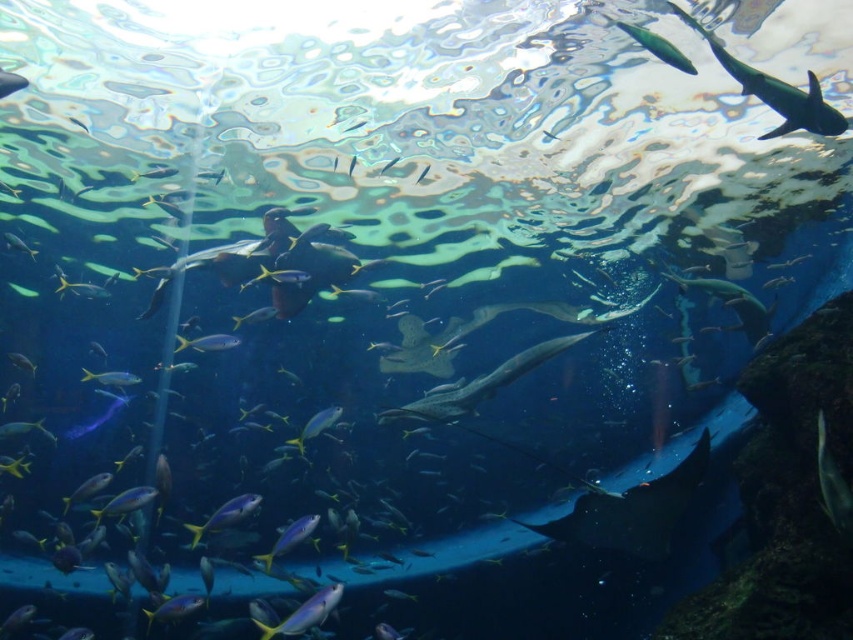
Question: Which point is closer to the camera?

Choices:
 (A) shiny silver fish at center
 (B) shiny silver shark at center
 (C) blue glossy fish at lower left
 (D) shiny silver fish at upper right

Answer: (D)

Question: Does shiny silver shark at center have a smaller size compared to blue glossy fish at lower center?

Choices:
 (A) no
 (B) yes

Answer: (A)

Question: Is shiny blue fish at center to the right of shiny silver fish at center from the viewer's perspective?

Choices:
 (A) no
 (B) yes

Answer: (B)

Question: Is blue glossy fish at lower left behind shiny silver fish at center?

Choices:
 (A) no
 (B) yes

Answer: (A)

Question: Estimate the real-world distances between objects in this image. Which object is closer to the shiny blue fish at lower center?

Choices:
 (A) shiny silver fish at upper right
 (B) green glossy fish at upper right
 (C) blue glossy fish at lower center
 (D) shiny blue fish at center

Answer: (C)

Question: Which object is farther from the camera taking this photo?

Choices:
 (A) shiny silver fish at upper right
 (B) green glossy fish at upper right
 (C) blue glossy fish at lower center
 (D) shiny blue fish at center

Answer: (D)